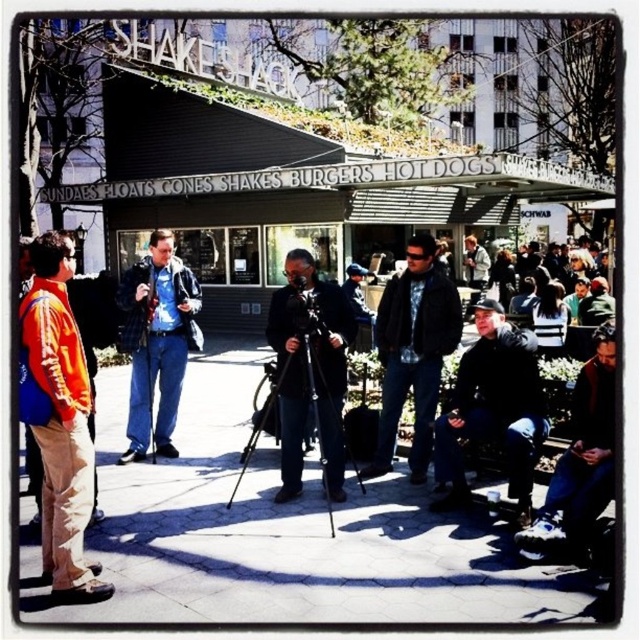
Can you confirm if orange jacket at left is bigger than dark blue jeans at lower right?

No, orange jacket at left is not bigger than dark blue jeans at lower right.

Between orange jacket at left and dark blue jeans at lower right, which one has less height?

With less height is orange jacket at left.

The height and width of the screenshot is (640, 640). I want to click on orange jacket at left, so click(x=60, y=420).

Is point (444, 348) in front of point (600, 504)?

That is False.

Between point (424, 442) and point (541, 513), which one is positioned in front?

Positioned in front is point (541, 513).

The image size is (640, 640). Describe the element at coordinates (413, 353) in the screenshot. I see `dark blue jacket at center` at that location.

Locate an element on the screen. dark blue jacket at center is located at coordinates (413, 353).

Locate an element on the screen. The width and height of the screenshot is (640, 640). orange jacket at left is located at coordinates (60, 420).

Measure the distance from orange jacket at left to black leather jacket at lower right.

A distance of 8.95 meters exists between orange jacket at left and black leather jacket at lower right.

Does point (54, 410) come farther from viewer compared to point (465, 369)?

That is False.

The width and height of the screenshot is (640, 640). Identify the location of orange jacket at left. (60, 420).